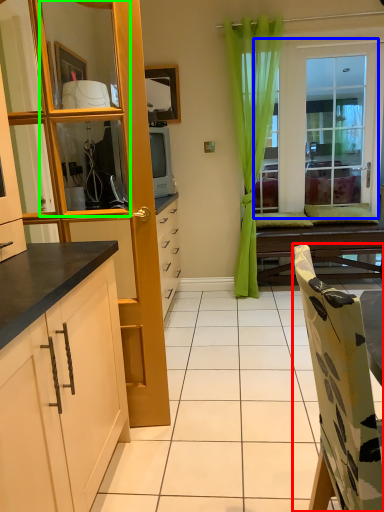
Question: Which is farther away from chair (highlighted by a red box)? window (highlighted by a blue box) or mirror (highlighted by a green box)?

Choices:
 (A) window
 (B) mirror

Answer: (A)